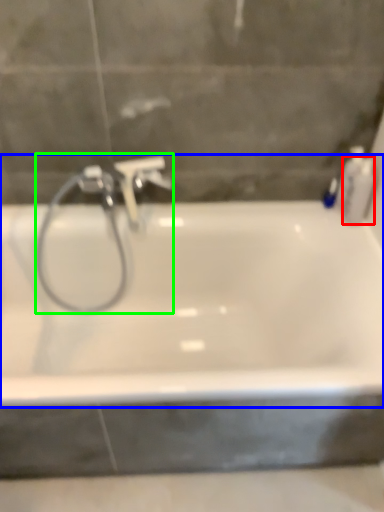
Question: Based on their relative distances, which object is nearer to toiletry (highlighted by a red box)? Choose from bathtub (highlighted by a blue box) and plumbing fixture (highlighted by a green box).

Choices:
 (A) bathtub
 (B) plumbing fixture

Answer: (A)